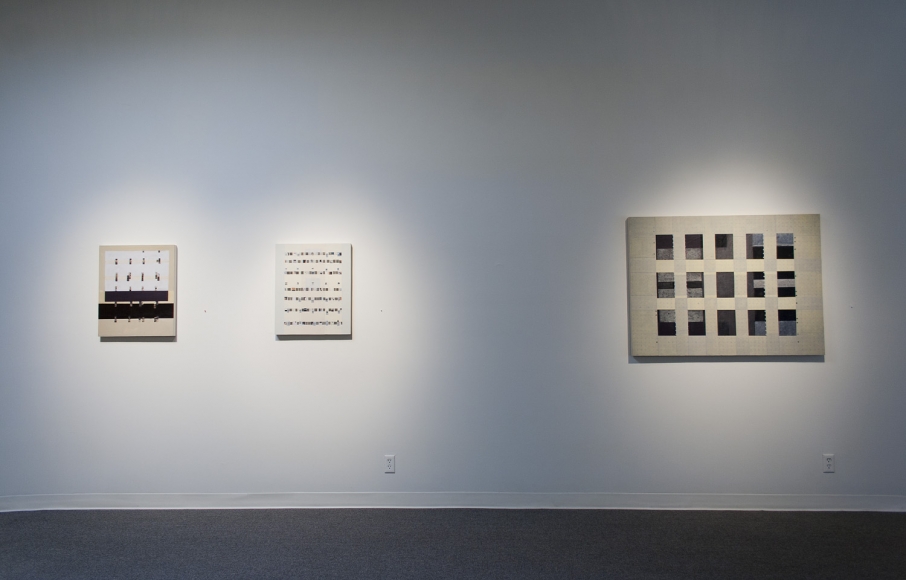
The image size is (906, 580). I want to click on artwork on display, so click(x=705, y=266), click(x=311, y=282), click(x=124, y=271).